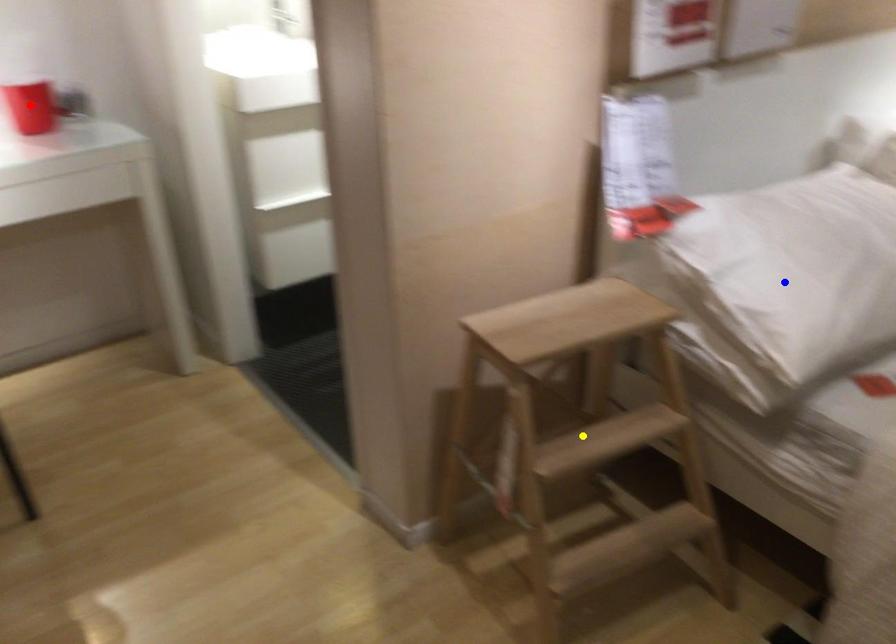
Order these from nearest to farthest:
yellow point | red point | blue point

red point, yellow point, blue point